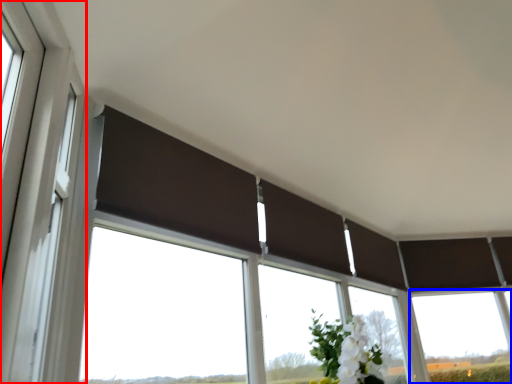
Question: Which object is closer to the camera taking this photo, window frame (highlighted by a red box) or window (highlighted by a blue box)?

Choices:
 (A) window frame
 (B) window

Answer: (A)